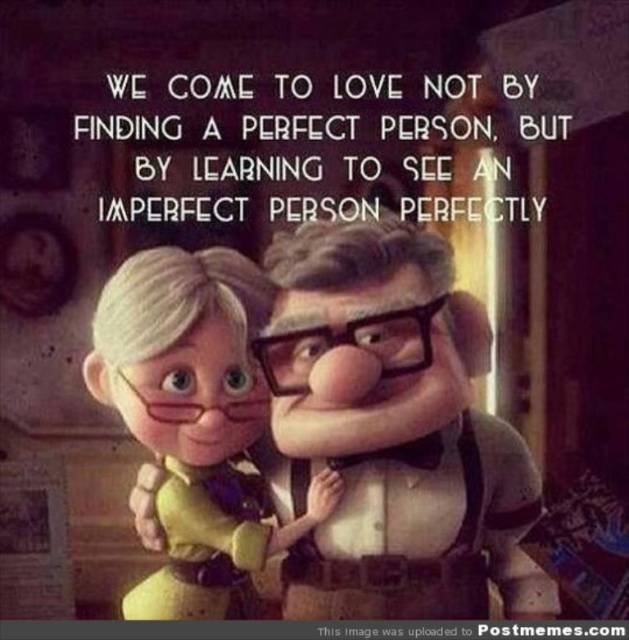
Question: Is matte yellow dress at center smaller than white paper at center?

Choices:
 (A) yes
 (B) no

Answer: (B)

Question: Which object is closer to the camera taking this photo?

Choices:
 (A) matte yellow dress at center
 (B) white paper at center

Answer: (A)

Question: Which point is farther to the camera?

Choices:
 (A) (464, 156)
 (B) (230, 316)

Answer: (A)

Question: Which point is farther from the camera taking this photo?

Choices:
 (A) (435, 196)
 (B) (238, 573)

Answer: (A)

Question: Is matte yellow dress at center to the right of white paper at center from the viewer's perspective?

Choices:
 (A) no
 (B) yes

Answer: (A)

Question: In this image, where is matte yellow dress at center located relative to white paper at center?

Choices:
 (A) below
 (B) above

Answer: (A)